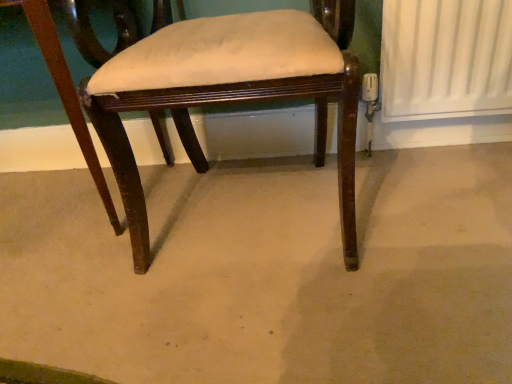
Question: In terms of width, does brown wood chair at center look wider or thinner when compared to mahogany wood chair at center?

Choices:
 (A) wide
 (B) thin

Answer: (A)

Question: From the image's perspective, is brown wood chair at center above or below mahogany wood chair at center?

Choices:
 (A) above
 (B) below

Answer: (B)

Question: From a real-world perspective, is brown wood chair at center positioned above or below mahogany wood chair at center?

Choices:
 (A) below
 (B) above

Answer: (A)

Question: From the image's perspective, relative to brown wood chair at center, is mahogany wood chair at center above or below?

Choices:
 (A) above
 (B) below

Answer: (A)

Question: Visually, is mahogany wood chair at center positioned to the left or to the right of brown wood chair at center?

Choices:
 (A) right
 (B) left

Answer: (A)

Question: From a real-world perspective, relative to brown wood chair at center, is mahogany wood chair at center vertically above or below?

Choices:
 (A) below
 (B) above

Answer: (B)

Question: Is mahogany wood chair at center in front of or behind brown wood chair at center in the image?

Choices:
 (A) front
 (B) behind

Answer: (B)